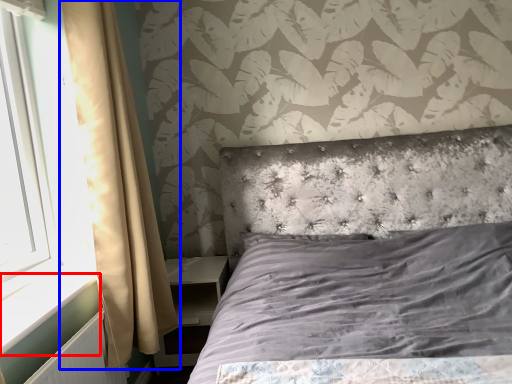
Question: Which object is closer to the camera taking this photo, window sill (highlighted by a red box) or curtain (highlighted by a blue box)?

Choices:
 (A) window sill
 (B) curtain

Answer: (A)